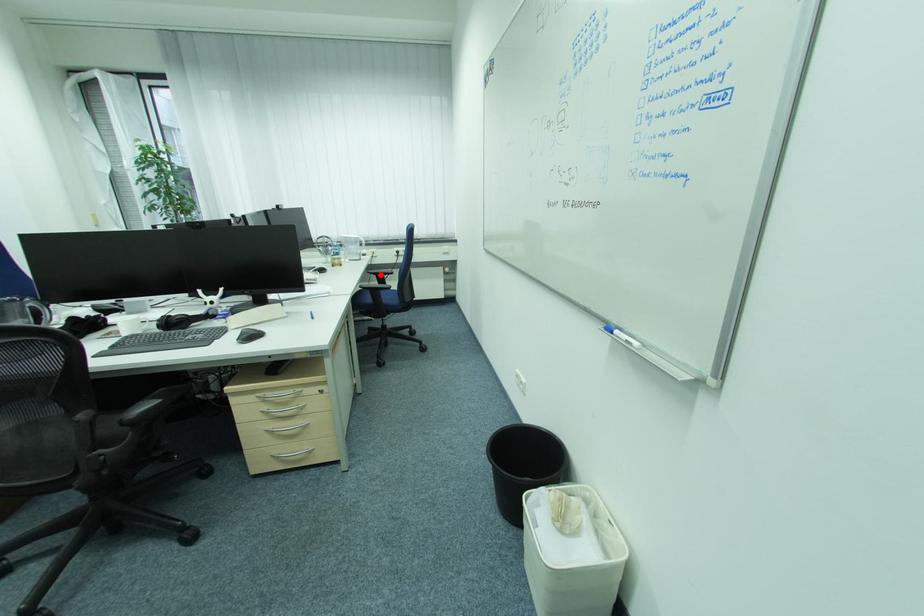
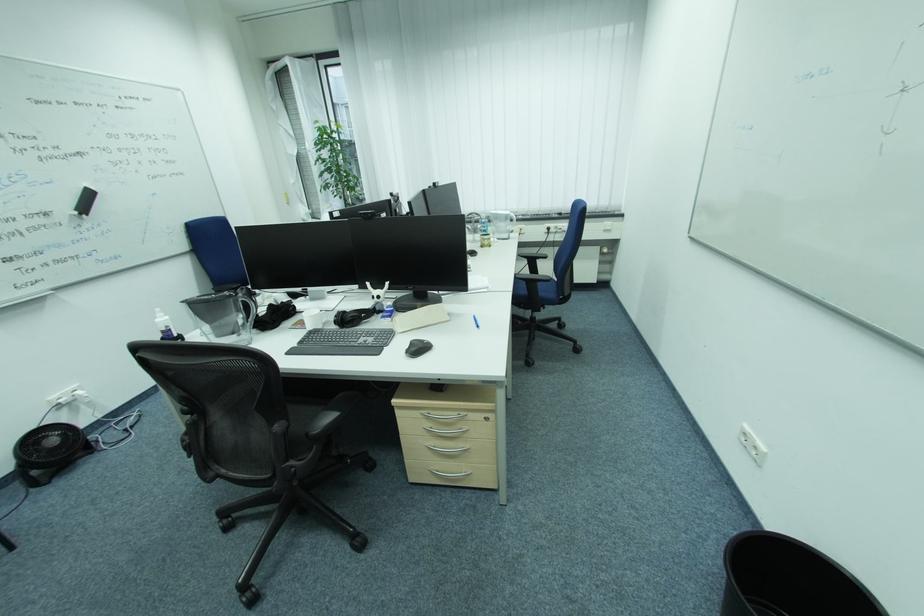
Question: I am providing you with two images of the same scene from different viewpoints. A red point is marked on the first image. At the location where the point appears in image 1, is it still visible in image 2?

Choices:
 (A) Yes
 (B) No

Answer: (A)